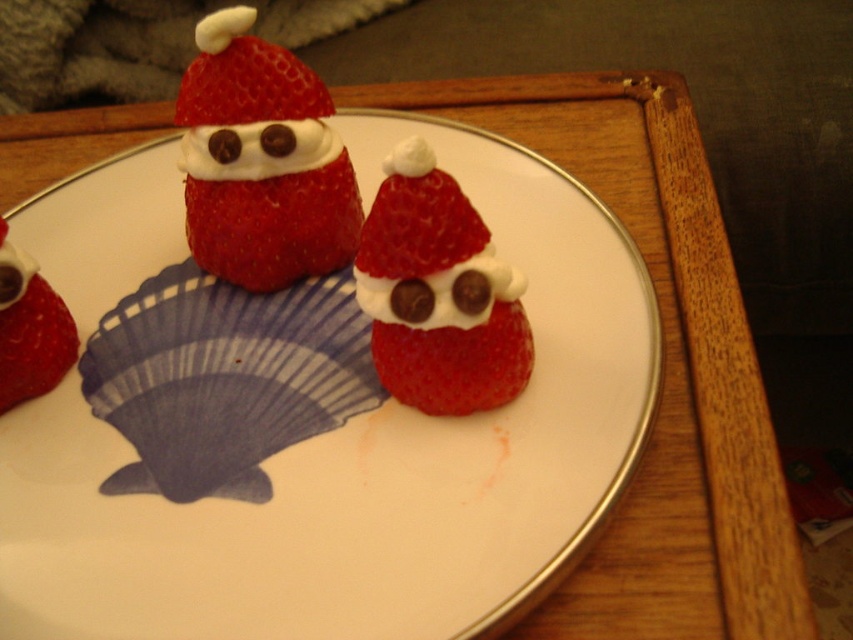
You are a food stylist arranging a plate with a shiny red strawberry at center. Where should you place the strawberry to ensure it is centered on the plate?

The shiny red strawberry at center should be placed at the coordinates point (438, 292) to ensure it is centered on the plate.

You are a food stylist arranging the Santa strawberries. You need to place a chocolate sprinkle on the part of the matte white cream at upper center that is closest to the white cream frosting at center. Where should you place the chocolate sprinkle?

The matte white cream at upper center is located above the white cream frosting at center, so the closest point would be the bottom edge of the matte white cream at upper center. Place the chocolate sprinkle there.

You are a food stylist arranging these Santa Claus strawberries. You need to place a tiny candy cane between the shiny red strawberry at center and the matte white cream at upper left. Which object should the candy cane be closer to?

The shiny red strawberry at center is closer to the viewer than the matte white cream at upper left, so the candy cane should be placed closer to the matte white cream at upper left to maintain visual balance.